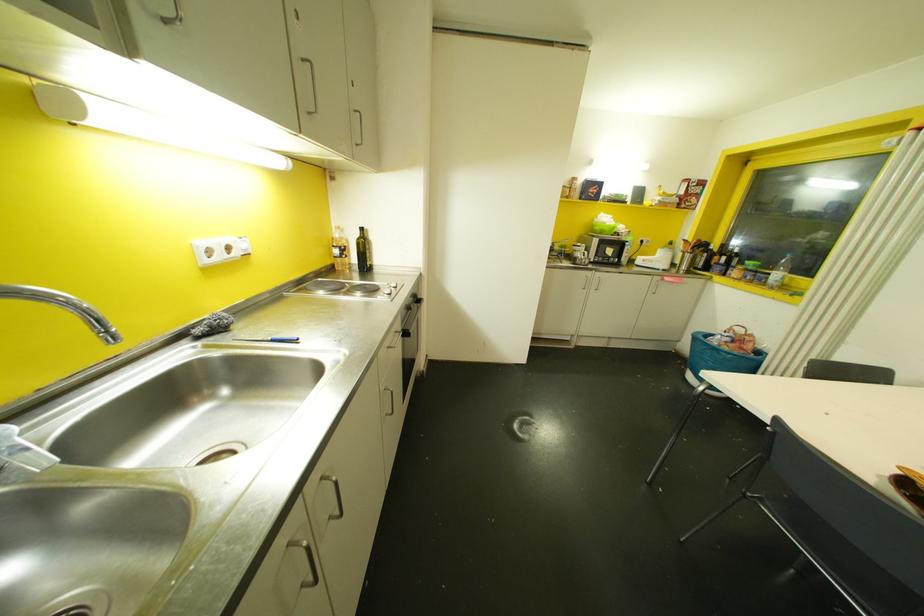
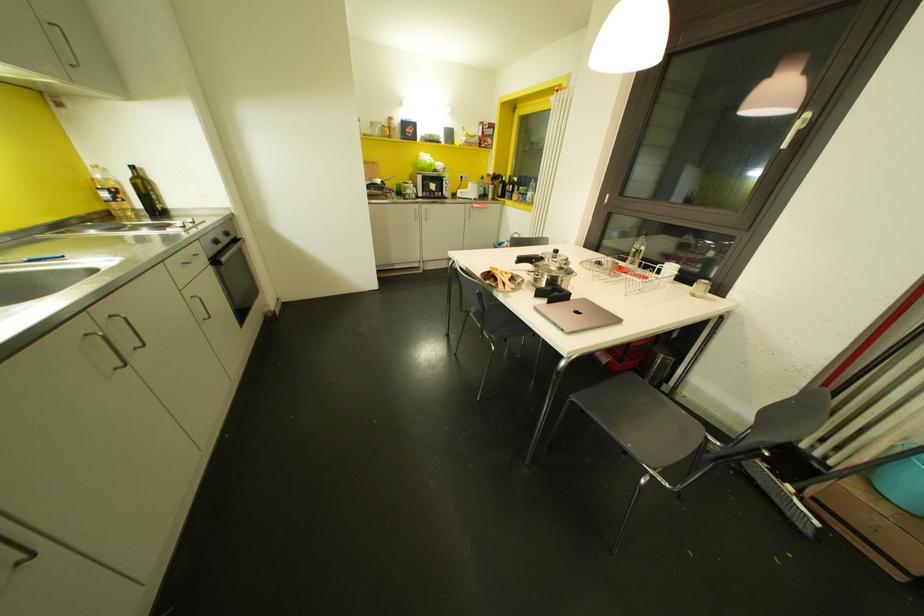
Question: The camera is either moving clockwise (left) or counter-clockwise (right) around the object. The first image is from the beginning of the video and the second image is from the end. Is the camera moving left or right when shooting the video?

Choices:
 (A) Left
 (B) Right

Answer: (A)